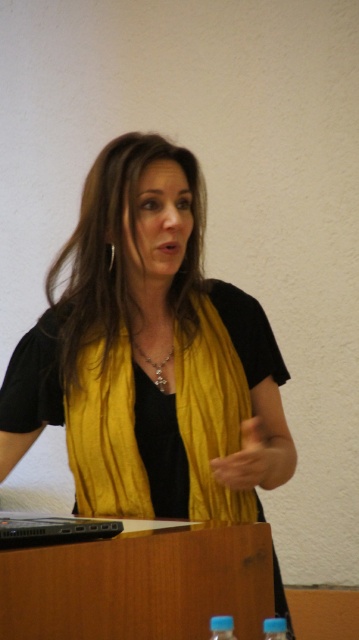
You are standing in front of the podium and want to place a small vase exactly at the point marked by coordinates point (91, 525). If the vase is 12 inches tall, will it be visible to the audience sitting 40 inches away from the podium?

The point (91, 525) is 39.09 inches from the viewer. Since the audience is 40 inches away, the vase placed there would be just slightly behind the audience, making it not visible. Therefore, the vase would not be visible to the audience.

You are organizing a presentation and need to place a name tag on the table. The name tag is 15 cm wide. Can the yellow silk scarf at center or the black plastic laptop at lower left accommodate it without overlapping?

The yellow silk scarf at center might be wider than the black plastic laptop at lower left. Therefore, if the scarf is indeed wider, placing the name tag there would be possible. However, since the laptop is narrower, it might not fit. Check the actual width of the scarf to confirm.